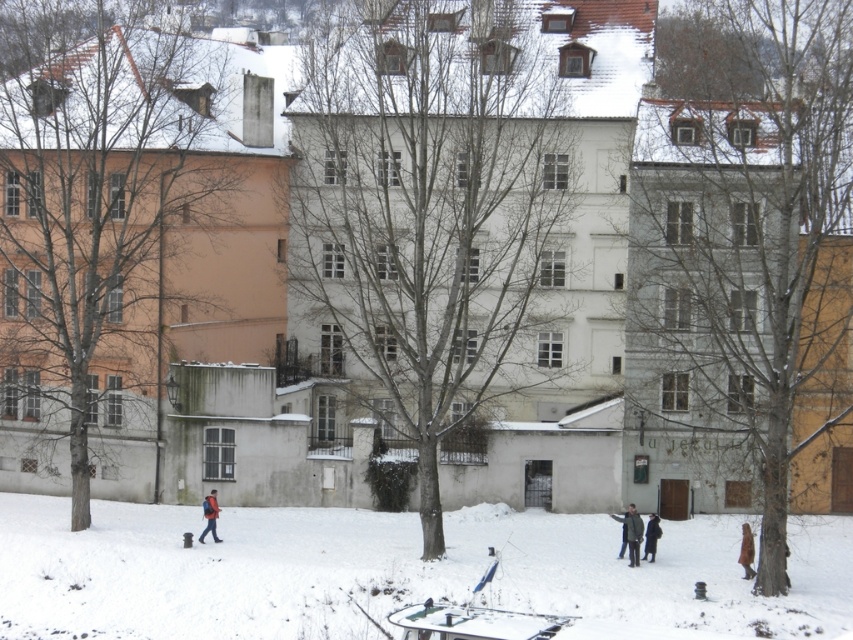
Does red backpack at lower center appear on the right side of dark wool coat at center?

In fact, red backpack at lower center is to the left of dark wool coat at center.

Can you confirm if red backpack at lower center is wider than dark wool coat at center?

Yes.

Is point (215, 532) farther from viewer compared to point (654, 522)?

That is True.

This screenshot has width=853, height=640. I want to click on red backpack at lower center, so click(x=210, y=516).

Between dark gray jacket at lower center and dark wool coat at center, which one is positioned higher?

Positioned higher is dark gray jacket at lower center.

Can you confirm if dark gray jacket at lower center is shorter than dark wool coat at center?

Indeed, dark gray jacket at lower center has a lesser height compared to dark wool coat at center.

Does point (639, 540) lie in front of point (650, 552)?

Yes.

I want to click on dark gray jacket at lower center, so click(x=631, y=532).

Which is more to the left, white powdery snow at lower left or dark wool coat at center?

Positioned to the left is white powdery snow at lower left.

Can you confirm if white powdery snow at lower left is wider than dark wool coat at center?

Correct, the width of white powdery snow at lower left exceeds that of dark wool coat at center.

Between point (51, 538) and point (651, 525), which one is positioned behind?

Point (51, 538)

The image size is (853, 640). In order to click on white powdery snow at lower left in this screenshot , I will do `click(387, 572)`.